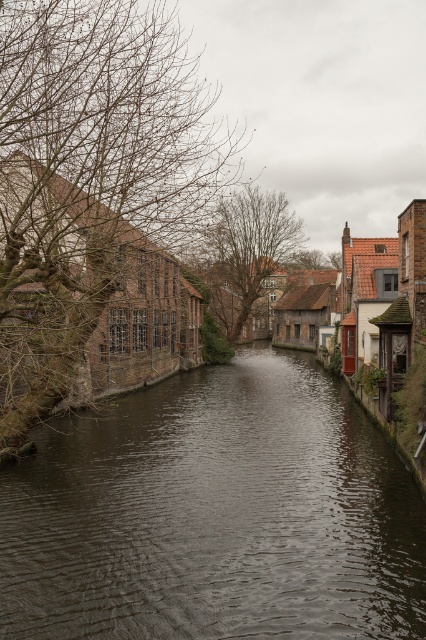
You are an artist sketching the canal scene. You notice the bare branches at left and the brown leafless tree at center. Which one has a thinner appearance?

The bare branches at left is thinner than the brown leafless tree at center.

You are standing on the right side of the canal in the scene. You want to cross to the left side. There is a point marked at coordinates (215, 515). What is located at that point?

The point at coordinates (215, 515) is occupied by dark brown water at center, so you would be stepping into the canal if you go there.